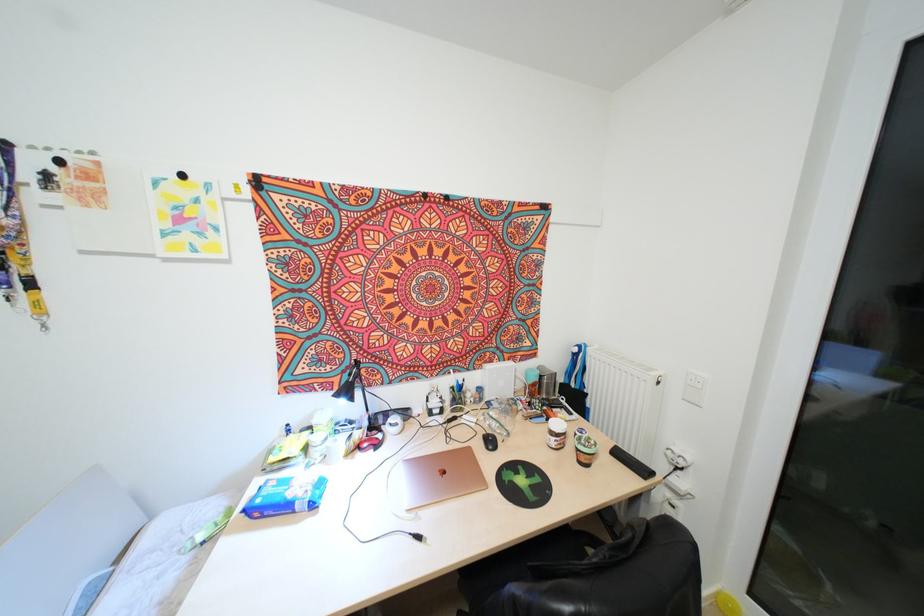
Identify the location of black binder clip. (631, 463).